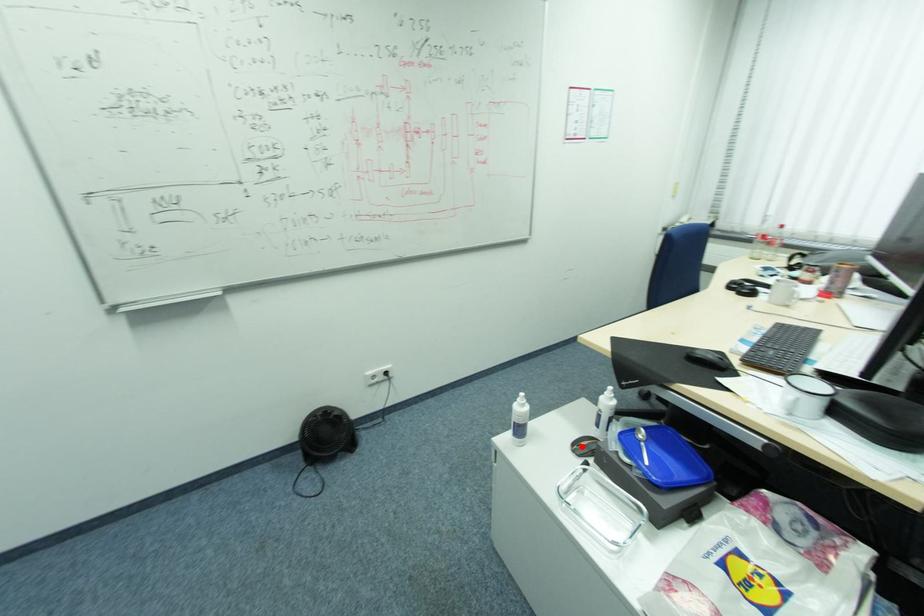
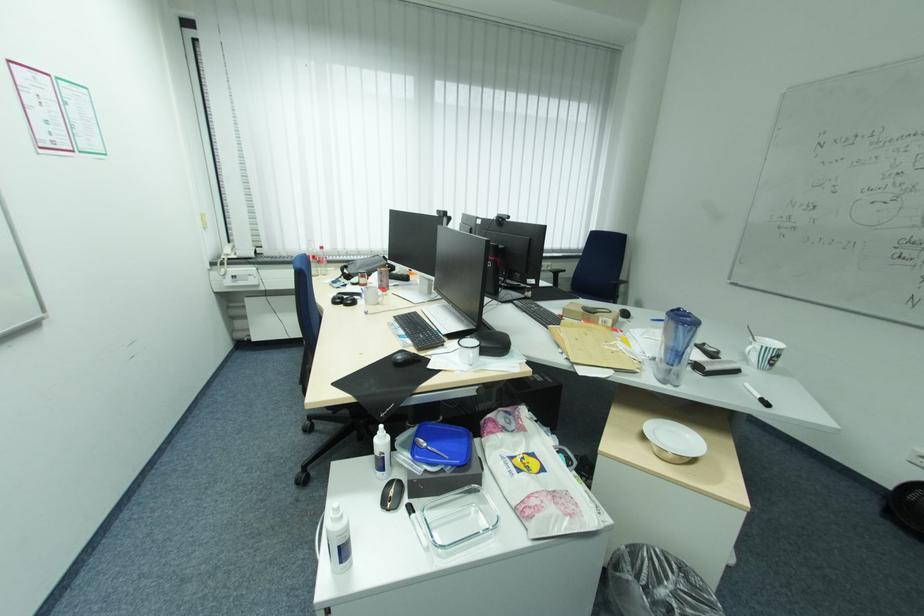
Find the pixel in the second image that matches the highlighted location in the first image.

(395, 504)